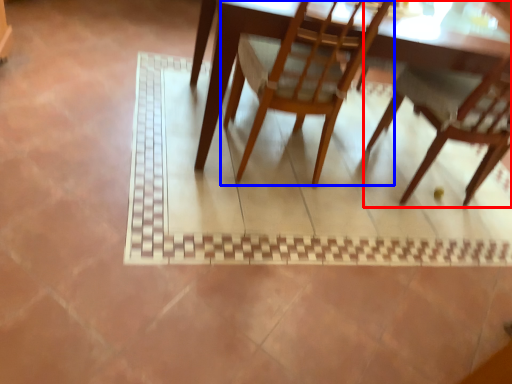
Question: Which of the following is the farthest to the observer, chair (highlighted by a red box) or chair (highlighted by a blue box)?

Choices:
 (A) chair
 (B) chair

Answer: (A)